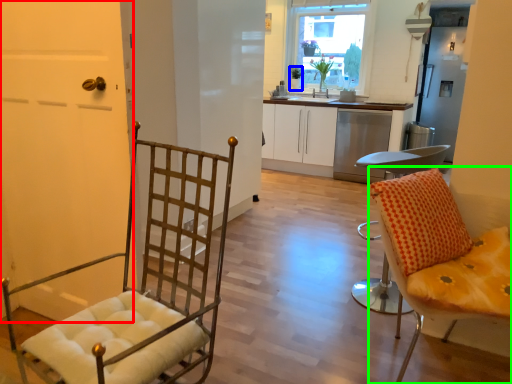
Question: Considering the real-world distances, which object is closest to door (highlighted by a red box)? houseplant (highlighted by a blue box) or chair (highlighted by a green box).

Choices:
 (A) houseplant
 (B) chair

Answer: (B)